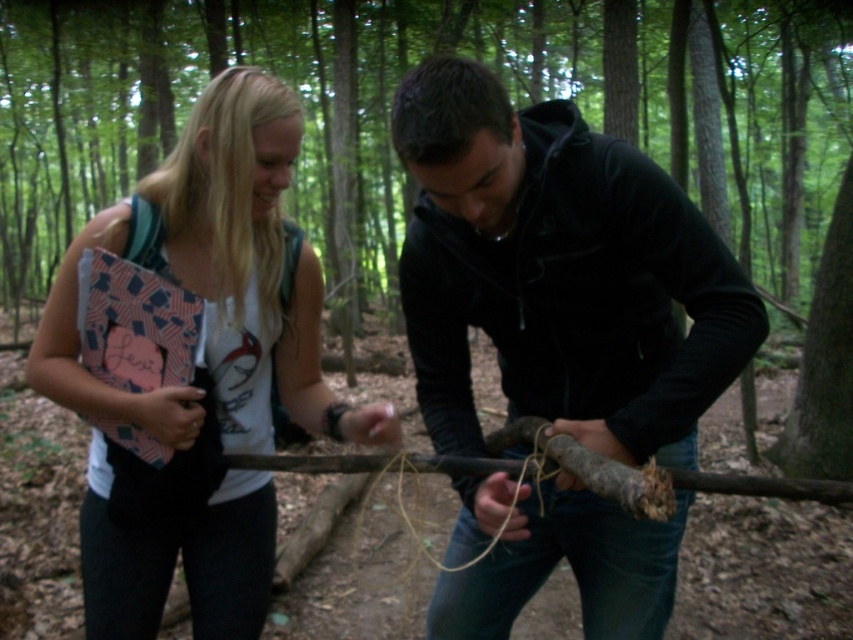
Does brown wood log at center lie behind matte pink notebook at left?

That is True.

Can you confirm if brown wood log at center is positioned above matte pink notebook at left?

Indeed, brown wood log at center is positioned over matte pink notebook at left.

Where is `brown wood log at center`? Image resolution: width=853 pixels, height=640 pixels. brown wood log at center is located at coordinates (514, 100).

Identify the location of brown wood log at center. (514, 100).

Can you confirm if brown wood log at center is wider than black matte stick at center?

Indeed, brown wood log at center has a greater width compared to black matte stick at center.

From the picture: Between brown wood log at center and black matte stick at center, which one appears on the right side from the viewer's perspective?

From the viewer's perspective, black matte stick at center appears more on the right side.

Which is in front, point (380, 172) or point (631, 579)?

Point (631, 579) is in front.

This screenshot has width=853, height=640. What are the coordinates of `brown wood log at center` in the screenshot? It's located at (514, 100).

Which is below, black matte stick at center or matte pink notebook at left?

black matte stick at center is lower down.

What do you see at coordinates (558, 273) in the screenshot?
I see `black matte stick at center` at bounding box center [558, 273].

The width and height of the screenshot is (853, 640). Find the location of `black matte stick at center`. black matte stick at center is located at coordinates (558, 273).